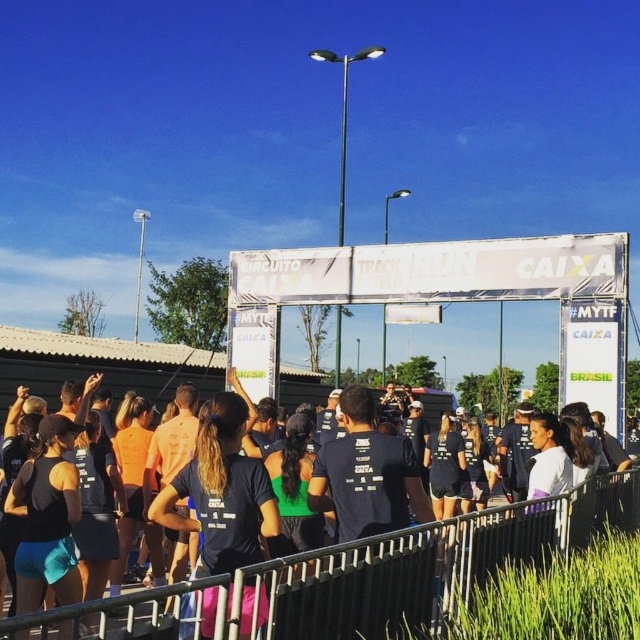
Question: Which point is closer to the camera?

Choices:
 (A) black matte t-shirt at center
 (B) metallic silver fence at center

Answer: (A)

Question: Does metallic silver fence at center have a smaller size compared to black matte t-shirt at center?

Choices:
 (A) no
 (B) yes

Answer: (B)

Question: Can you confirm if metallic silver fence at center is thinner than black matte t-shirt at center?

Choices:
 (A) no
 (B) yes

Answer: (A)

Question: Which point is farther from the camera taking this photo?

Choices:
 (A) (273, 531)
 (B) (113, 624)

Answer: (B)

Question: Can you confirm if metallic silver fence at center is positioned below black matte t-shirt at center?

Choices:
 (A) no
 (B) yes

Answer: (B)